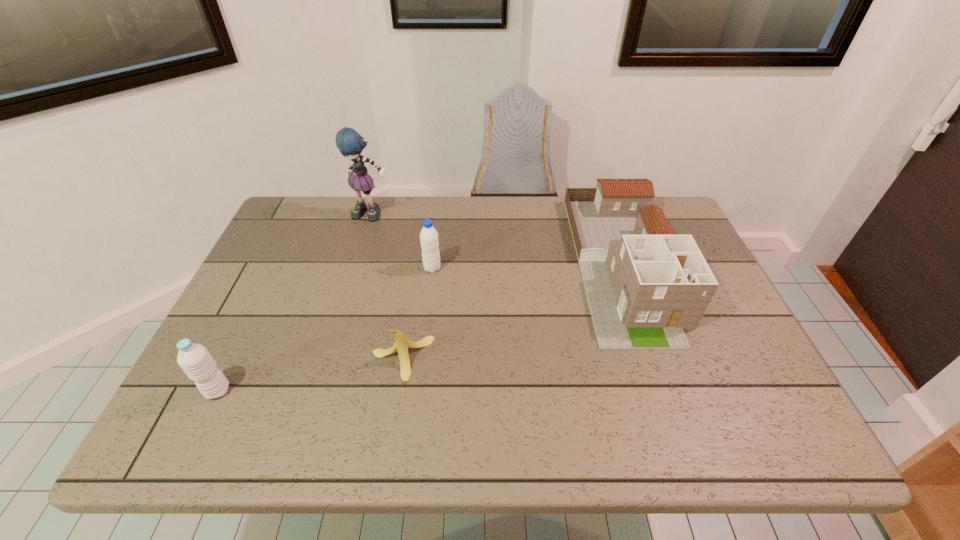
In the image, there is a desktop. Identify the location of vacant space at the right edge. click(x=730, y=332).

In order to click on vacant space at the far left corner in this screenshot , I will do `click(289, 239)`.

The height and width of the screenshot is (540, 960). In the image, there is a desktop. In order to click on vacant area at the near right corner in this screenshot , I will do pos(705,413).

The width and height of the screenshot is (960, 540). I want to click on vacant area between the shortest object and the rightmost object, so click(x=513, y=311).

Find the location of a particular element. free spot between the shortest object and the right water bottle is located at coordinates (417, 314).

This screenshot has height=540, width=960. In order to click on free area in between the leftmost object and the dollhouse in this screenshot , I will do `click(420, 327)`.

Identify the location of blank region between the rag doll and the farther water bottle. The image size is (960, 540). (402, 241).

Image resolution: width=960 pixels, height=540 pixels. What are the coordinates of `vacant space that's between the fourth shortest object and the shortest object` in the screenshot? It's located at (513, 311).

The height and width of the screenshot is (540, 960). What are the coordinates of `free area in between the nearer water bottle and the fourth shortest object` in the screenshot? It's located at (420, 327).

What are the coordinates of `empty space between the banana and the tallest object` in the screenshot? It's located at (387, 287).